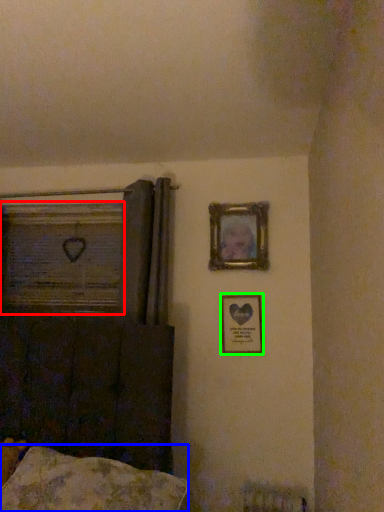
Question: Which object is positioned closest to window frame (highlighted by a red box)? Select from pillow (highlighted by a blue box) and picture frame (highlighted by a green box).

Choices:
 (A) pillow
 (B) picture frame

Answer: (B)